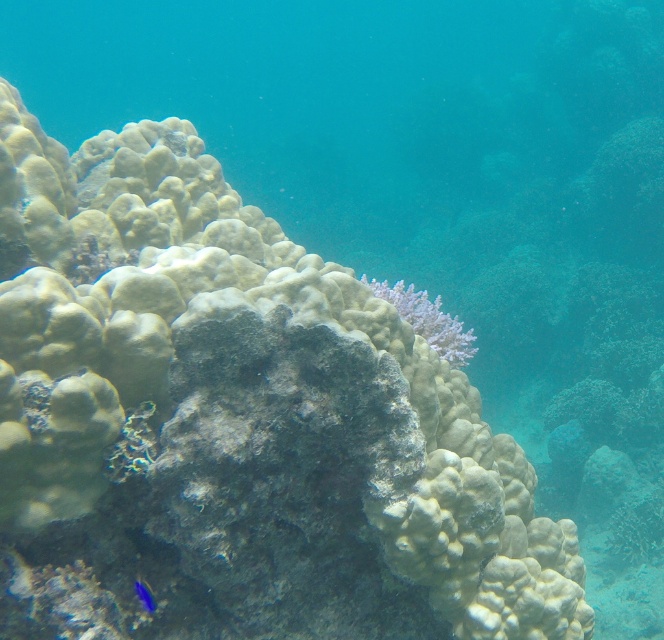
Question: Which of the following is the farthest from the observer?

Choices:
 (A) (384, 298)
 (B) (145, 588)

Answer: (A)

Question: Does white matte coral at center come in front of blue glossy fish at lower left?

Choices:
 (A) no
 (B) yes

Answer: (A)

Question: Does white matte coral at center appear under blue glossy fish at lower left?

Choices:
 (A) yes
 (B) no

Answer: (B)

Question: Is white matte coral at center to the right of blue glossy fish at lower left from the viewer's perspective?

Choices:
 (A) no
 (B) yes

Answer: (B)

Question: Which point is closer to the camera?

Choices:
 (A) (390, 296)
 (B) (145, 588)

Answer: (B)